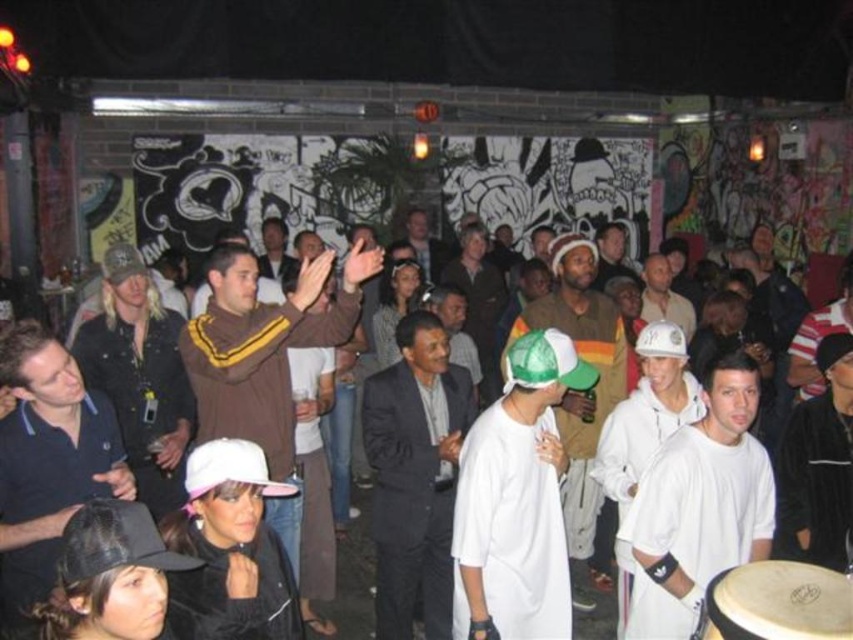
Question: Does dark blue polo shirt at center have a smaller size compared to white matte baseball cap at center?

Choices:
 (A) no
 (B) yes

Answer: (B)

Question: Which point is farther from the camera taking this photo?

Choices:
 (A) (590, 618)
 (B) (260, 269)

Answer: (B)

Question: Which object appears farthest from the camera in this image?

Choices:
 (A) dark gray suit at center
 (B) white matte baseball cap at center
 (C) dark brown leather jacket at center
 (D) white cotton crowd at center

Answer: (C)

Question: Is brown fleece jacket at center wider than light brown leather jacket at center?

Choices:
 (A) no
 (B) yes

Answer: (B)

Question: Based on their relative distances, which object is nearer to the light brown leather jacket at center?

Choices:
 (A) dark blue polo shirt at center
 (B) white cotton crowd at center

Answer: (B)

Question: Can you confirm if white matte t-shirt at center is smaller than matte brown jacket at center?

Choices:
 (A) no
 (B) yes

Answer: (B)